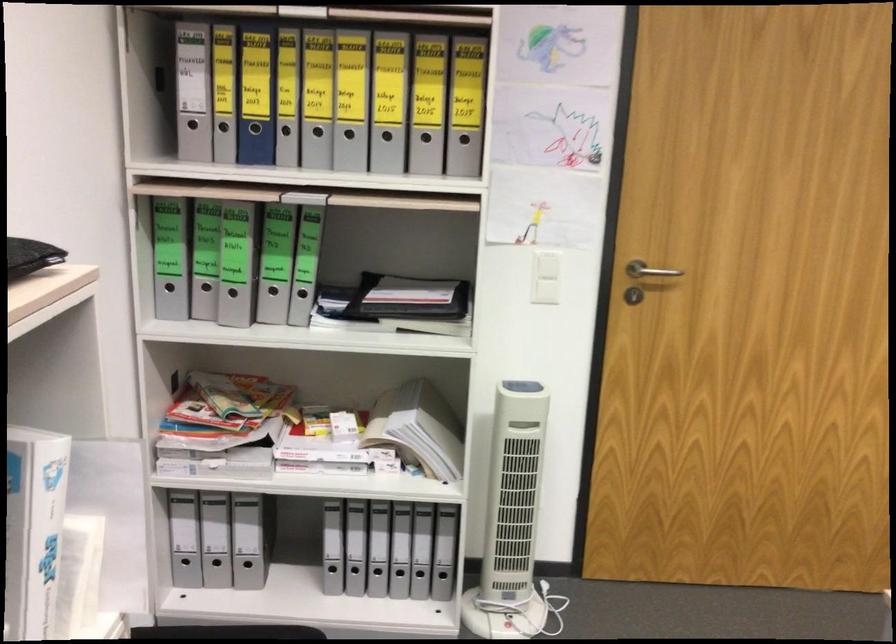
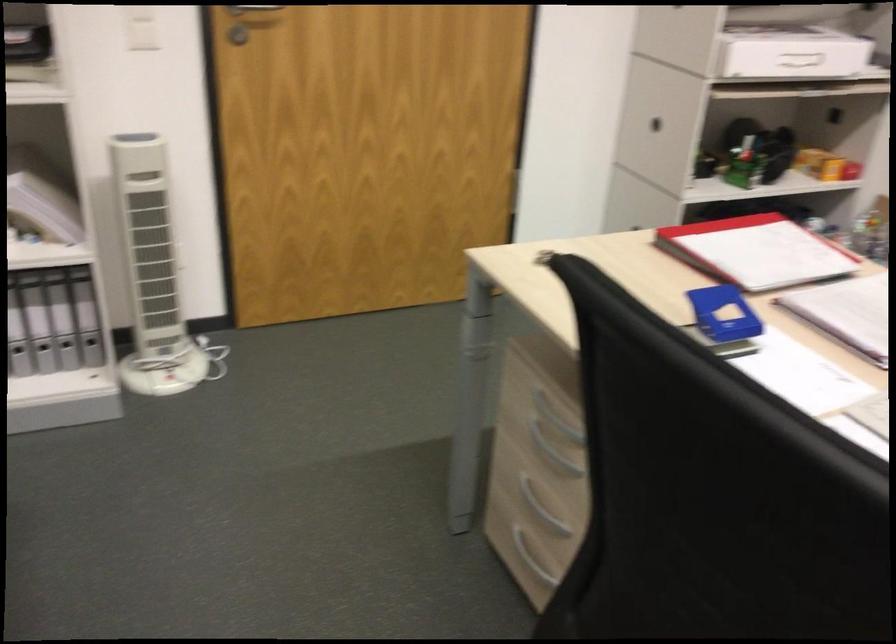
The point at (513,518) is marked in the first image. Where is the corresponding point in the second image?

(151, 272)